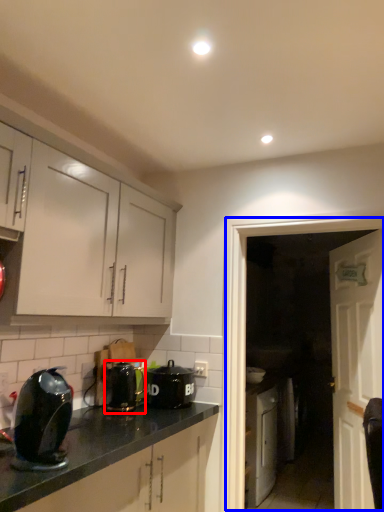
Question: Which point is closer to the camera, kitchen appliance (highlighted by a red box) or glass door (highlighted by a blue box)?

Choices:
 (A) kitchen appliance
 (B) glass door

Answer: (B)